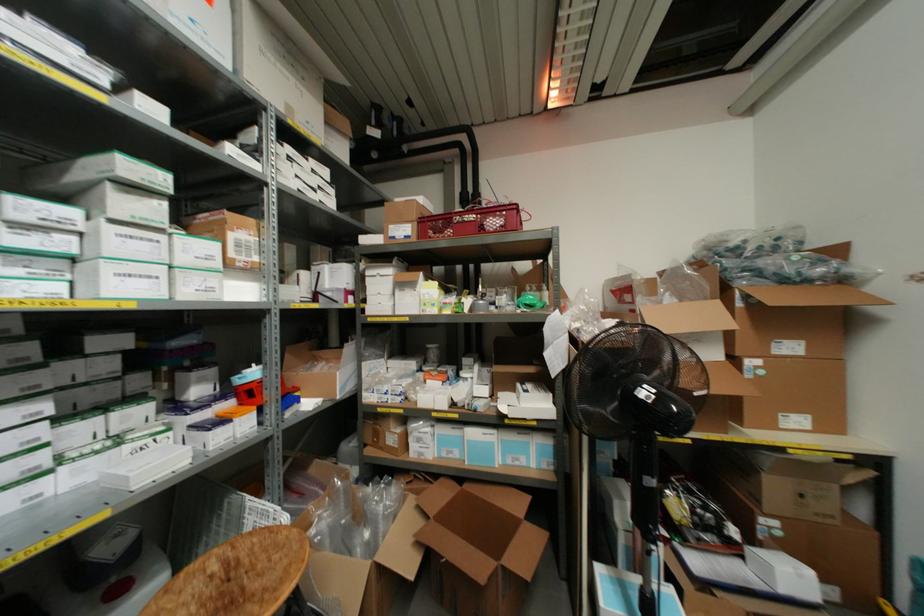
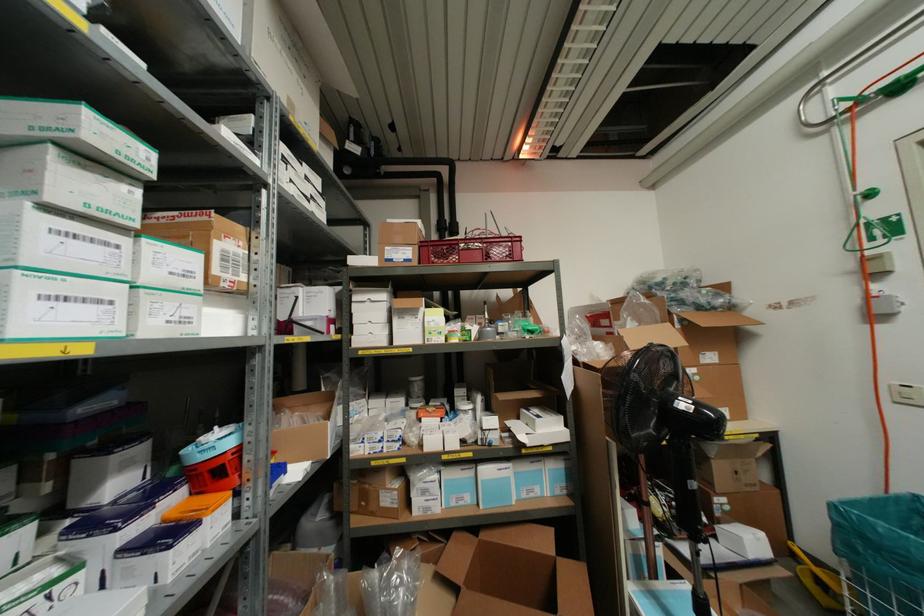
Where in the second image is the point corresponding to pixel 216 264 from the first image?

(196, 283)